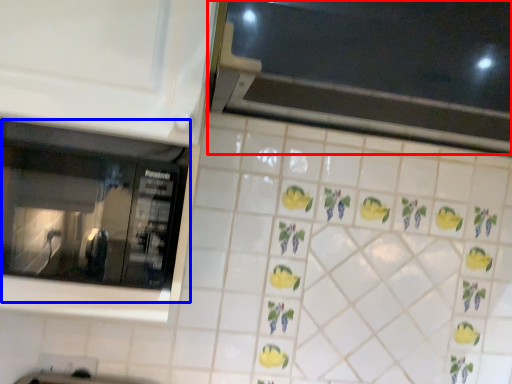
Question: Which of the following is the farthest to the observer, window (highlighted by a red box) or window (highlighted by a blue box)?

Choices:
 (A) window
 (B) window

Answer: (B)